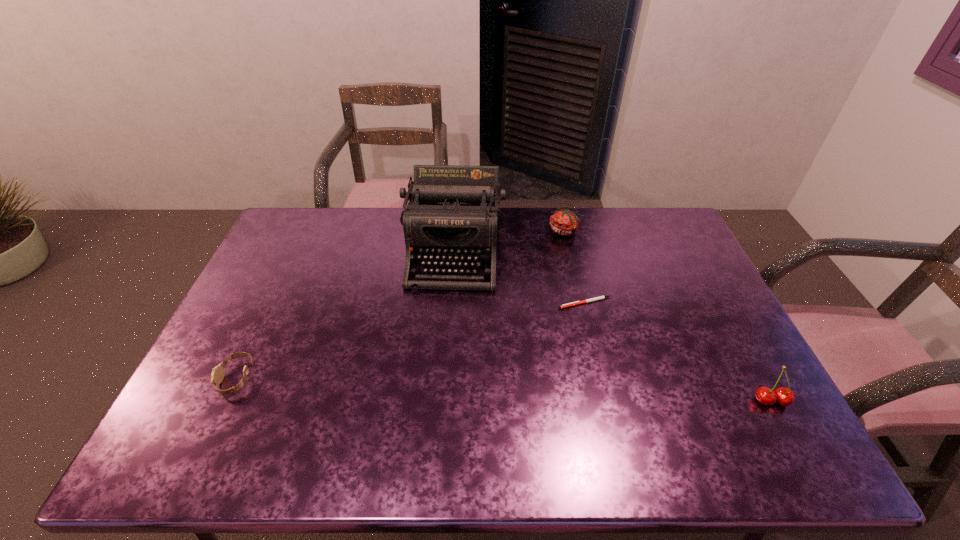
At what (x,y) coordinates should I click in order to perform the action: click on empty space that is in between the third tallest object and the watch. Please return your answer as a coordinate pair (x, y). Looking at the image, I should click on (400, 305).

You are a GUI agent. You are given a task and a screenshot of the screen. Output one action in this format:
    pyautogui.click(x=<x>, y=<y>)
    Task: Click on the free space between the cherry and the tomato
    
    Given the screenshot: What is the action you would take?
    pyautogui.click(x=668, y=316)

Point out which object is positioned as the nearest to the second tallest object. Please provide its 2D coordinates. Your answer should be formatted as a tuple, i.e. [(x, y)], where the tuple contains the x and y coordinates of a point satisfying the conditions above.

[(601, 297)]

Locate an element on the screen. the fourth closest object relative to the pen is located at coordinates (217, 375).